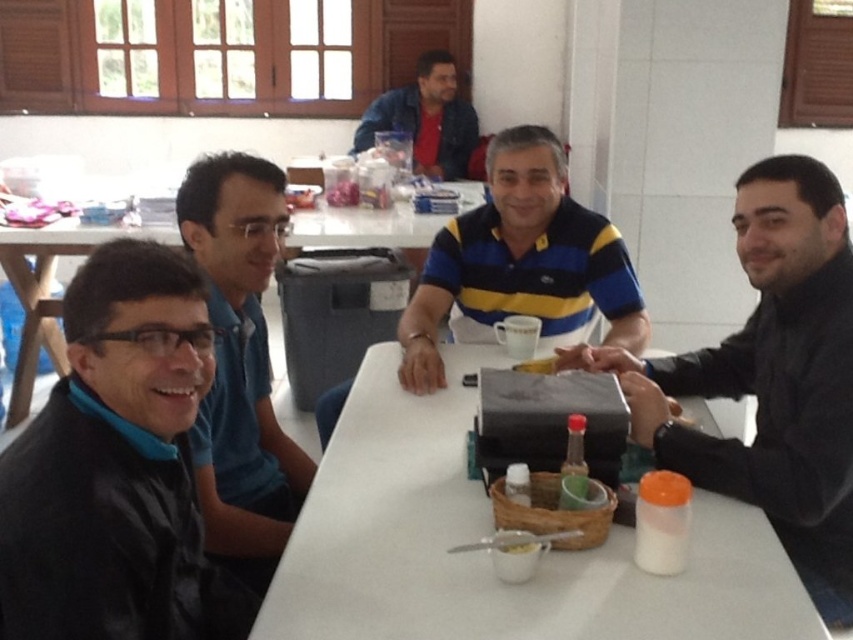
Is white matte table at center to the left of black matte shirt at right from the viewer's perspective?

Correct, you'll find white matte table at center to the left of black matte shirt at right.

Between white matte table at center and black matte shirt at right, which one appears on the left side from the viewer's perspective?

From the viewer's perspective, white matte table at center appears more on the left side.

Is point (354, 474) less distant than point (761, 220)?

Yes, it is in front of point (761, 220).

The height and width of the screenshot is (640, 853). I want to click on white matte table at center, so click(486, 554).

Can you confirm if yellow striped polo shirt at center is shorter than white glossy table at center?

In fact, yellow striped polo shirt at center may be taller than white glossy table at center.

Who is positioned more to the right, yellow striped polo shirt at center or white glossy table at center?

yellow striped polo shirt at center is more to the right.

Between point (561, 166) and point (123, 228), which one is positioned in front?

Point (561, 166)

The height and width of the screenshot is (640, 853). Find the location of `yellow striped polo shirt at center`. yellow striped polo shirt at center is located at coordinates (521, 260).

From the picture: Does yellow striped polo shirt at center appear over denim jacket at upper center?

No.

Locate an element on the screen. yellow striped polo shirt at center is located at coordinates (521, 260).

The height and width of the screenshot is (640, 853). What are the coordinates of `yellow striped polo shirt at center` in the screenshot? It's located at (521, 260).

Locate an element on the screen. yellow striped polo shirt at center is located at coordinates (521, 260).